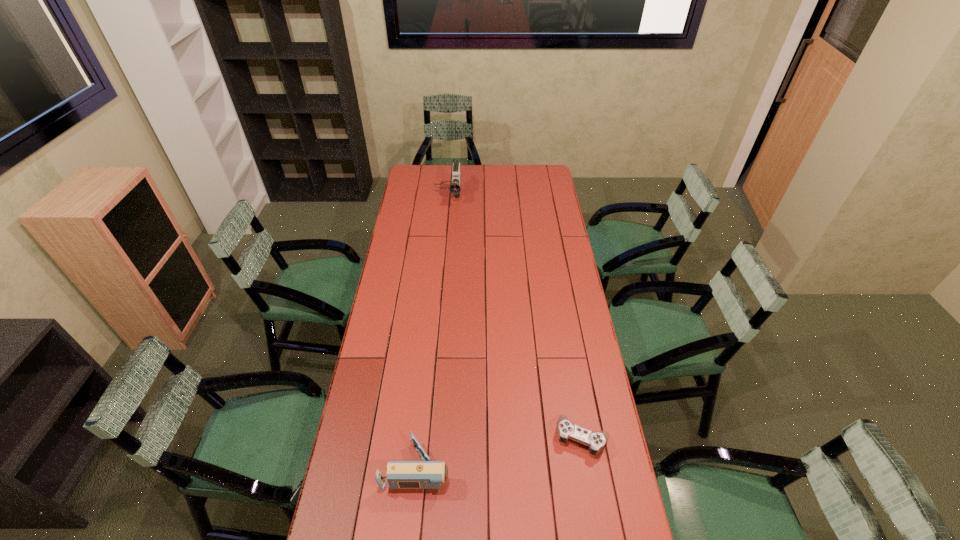
Image resolution: width=960 pixels, height=540 pixels. I want to click on free space that satisfies the following two spatial constraints: 1. on the front side of the control; 2. on the side of the second shortest object with the flip-out screen, so click(588, 467).

At what (x,y) coordinates should I click in order to perform the action: click on vacant point that satisfies the following two spatial constraints: 1. on the recording direction of the control; 2. on the left side of the farthest object. Please return your answer as a coordinate pair (x, y). This screenshot has width=960, height=540. Looking at the image, I should click on (425, 437).

Find the location of `free point that satisfies the following two spatial constraints: 1. on the recording direction of the shortest object; 2. on the left side of the farthest object`. free point that satisfies the following two spatial constraints: 1. on the recording direction of the shortest object; 2. on the left side of the farthest object is located at coordinates (425, 437).

I want to click on free spot that satisfies the following two spatial constraints: 1. on the recording direction of the farthest object; 2. on the side of the nearer camcorder with the flip-out screen, so click(x=422, y=467).